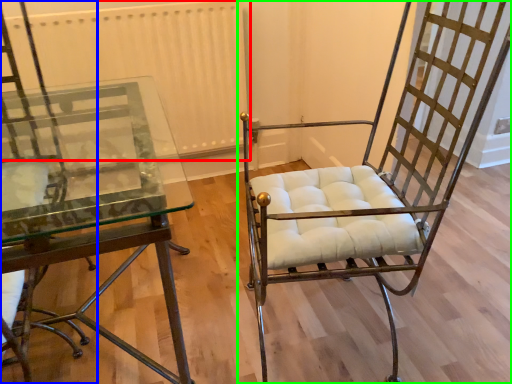
Question: Estimate the real-world distances between objects in this image. Which object is farther from radiator (highlighted by a red box), chair (highlighted by a blue box) or chair (highlighted by a green box)?

Choices:
 (A) chair
 (B) chair

Answer: (B)